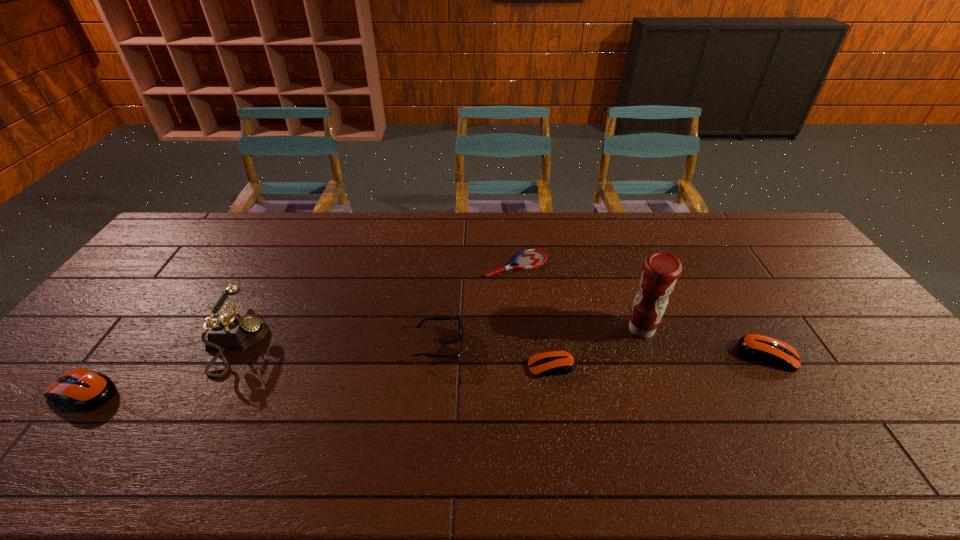
Locate an element on the screen. the leftmost computer mouse is located at coordinates (84, 390).

The width and height of the screenshot is (960, 540). I want to click on the sixth tallest object, so click(558, 362).

The height and width of the screenshot is (540, 960). Find the location of `the shortest computer mouse`. the shortest computer mouse is located at coordinates (558, 362).

Locate an element on the screen. the rightmost object is located at coordinates (764, 349).

Identify the location of the rightmost computer mouse. The height and width of the screenshot is (540, 960). (764, 349).

Identify the location of tennis racket. (529, 259).

This screenshot has width=960, height=540. What are the coordinates of `the farthest object` in the screenshot? It's located at pos(529,259).

At what (x,y) coordinates should I click in order to perform the action: click on the sixth object from left to right. Please return your answer as a coordinate pair (x, y). The width and height of the screenshot is (960, 540). Looking at the image, I should click on (661, 269).

Where is `condiment`? The width and height of the screenshot is (960, 540). condiment is located at coordinates (661, 269).

Locate an element on the screen. sunglasses is located at coordinates (460, 326).